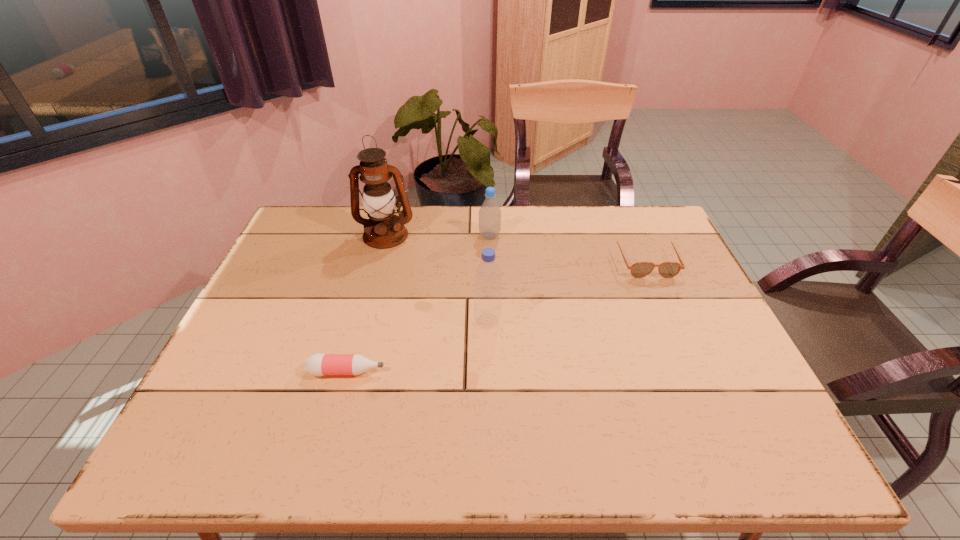
Locate an element on the screen. free space at the left edge is located at coordinates (279, 332).

In order to click on vacant space at the far left corner of the desktop in this screenshot , I will do `click(314, 231)`.

I want to click on free space at the far right corner of the desktop, so click(654, 246).

This screenshot has width=960, height=540. What are the coordinates of `free space between the rightmost object and the lantern` in the screenshot? It's located at 516,247.

Where is `empty location between the third shortest object and the shortest bottle`? This screenshot has width=960, height=540. empty location between the third shortest object and the shortest bottle is located at coordinates (419, 303).

The height and width of the screenshot is (540, 960). Identify the location of free spot between the sunglasses and the lantern. (516, 247).

Where is `blank region between the tallest object and the sunglasses`? The height and width of the screenshot is (540, 960). blank region between the tallest object and the sunglasses is located at coordinates (516, 247).

Image resolution: width=960 pixels, height=540 pixels. I want to click on free space between the rightmost object and the tallest object, so [x=516, y=247].

The height and width of the screenshot is (540, 960). I want to click on vacant space in between the sunglasses and the second tallest bottle, so click(x=567, y=248).

I want to click on free space between the nearest bottle and the third tallest object, so click(419, 303).